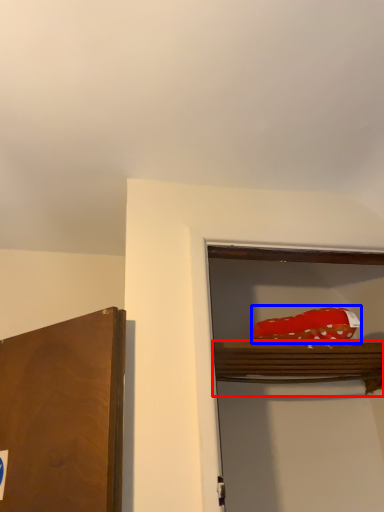
Question: Among these objects, which one is farthest to the camera, shelf (highlighted by a red box) or food (highlighted by a blue box)?

Choices:
 (A) shelf
 (B) food

Answer: (B)